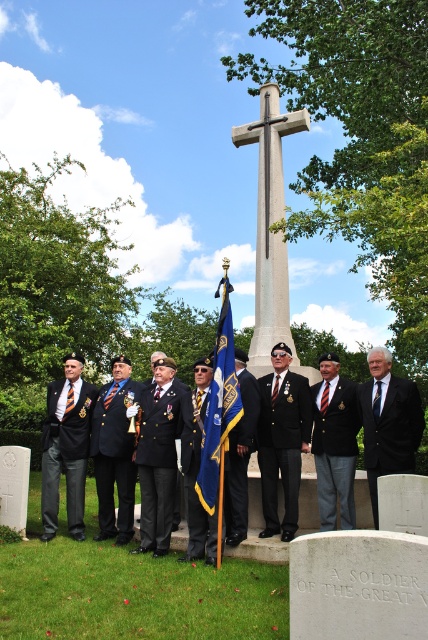
You are a photographer positioned at the origin point of the image. You want to capture a closeup shot of the dark blue wool blazer at center. Which direction should you move your camera to focus on it?

The dark blue wool blazer at center is located at point 0.708 on the x axis and 0.785 on the y axis. Since the photographer is at the origin point, they should move the camera to the right and upwards to focus on the blazer.

You are a photographer positioned in front of the large stone cross monument. You need to capture a photo of both the dark blue wool blazer at center and the black wool suit at right. Which of the two should you focus on first to ensure they are both in frame?

The dark blue wool blazer at center is taller than the black wool suit at right, so you should focus on the dark blue wool blazer at center first to ensure both are in frame.